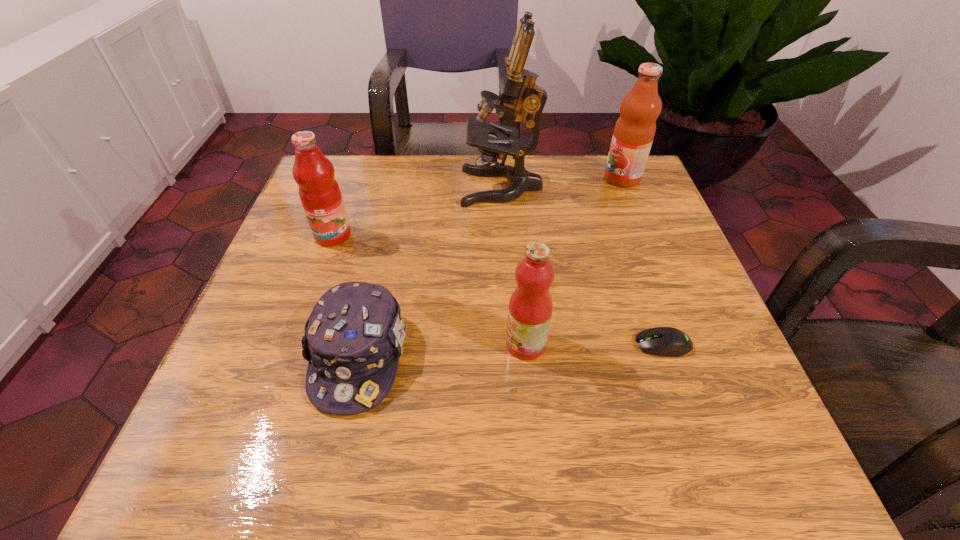
This screenshot has width=960, height=540. I want to click on vacant space at the left edge, so click(281, 298).

This screenshot has height=540, width=960. What are the coordinates of `free location at the right edge of the desktop` in the screenshot? It's located at (659, 410).

The image size is (960, 540). In the image, there is a desktop. In order to click on vacant space at the far left corner in this screenshot , I will do `click(353, 178)`.

Image resolution: width=960 pixels, height=540 pixels. I want to click on free region at the near right corner of the desktop, so click(701, 456).

You are a GUI agent. You are given a task and a screenshot of the screen. Output one action in this format:
    pyautogui.click(x=<x>, y=<y>)
    Task: Click on the free space between the shortest object and the second farthest fruit juice
    Image resolution: width=960 pixels, height=540 pixels.
    Given the screenshot: What is the action you would take?
    pyautogui.click(x=498, y=290)

The image size is (960, 540). In order to click on vacant area between the farthest fruit juice and the shortest object in this screenshot , I will do `click(642, 261)`.

The width and height of the screenshot is (960, 540). Find the location of `empty space that is in between the tallest object and the shortest object`. empty space that is in between the tallest object and the shortest object is located at coordinates (583, 266).

Where is `blank region between the rightmost fruit juice and the nearest fruit juice`? blank region between the rightmost fruit juice and the nearest fruit juice is located at coordinates (574, 261).

Where is `free space between the microscope and the second shortest object`? Image resolution: width=960 pixels, height=540 pixels. free space between the microscope and the second shortest object is located at coordinates (430, 272).

Identify the location of vacant area that lies between the tallest object and the shortest object. This screenshot has width=960, height=540. (583, 266).